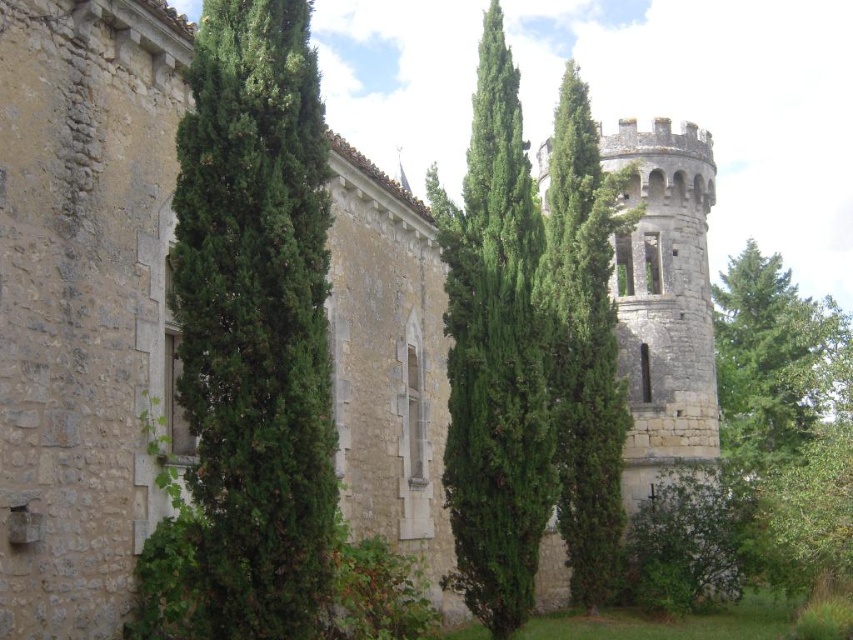
You are a visitor standing in front of the historic stone building. You notice the green textured tree at left and the green textured stone tower at center. Which object is closer to you?

The green textured tree at left is closer to you because it is positioned in front of the green textured stone tower at center.

Looking at this image, you are a painter standing in front of the historic stone building. You want to paint both the green textured tree at left and the green textured stone tower at center. Which object should you focus on first if you want to paint the wider one first?

The green textured stone tower at center is wider than the green textured tree at left, so you should focus on painting the green textured stone tower at center first.